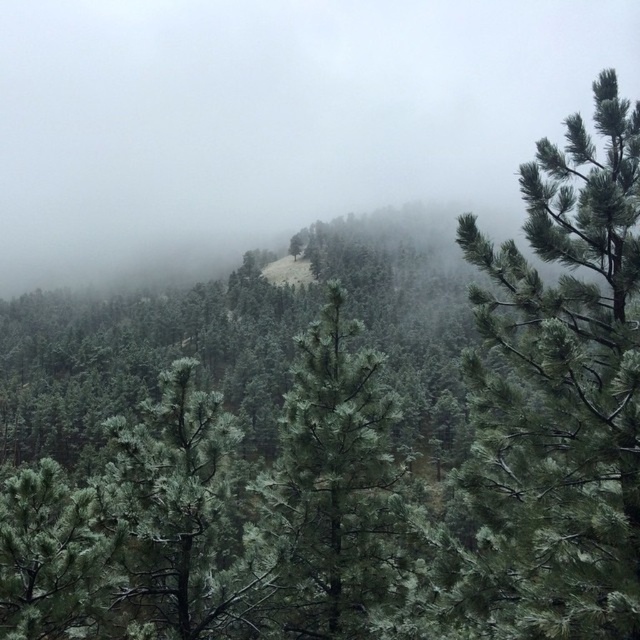
Question: Which point appears farthest from the camera in this image?

Choices:
 (A) (628, 262)
 (B) (323, 353)

Answer: (B)

Question: Among these points, which one is nearest to the camera?

Choices:
 (A) (358, 595)
 (B) (563, 157)

Answer: (B)

Question: Does green matte pine tree at center have a greater width compared to green needle-like tree at center?

Choices:
 (A) no
 (B) yes

Answer: (B)

Question: Is green matte pine tree at center positioned before green needle-like tree at center?

Choices:
 (A) yes
 (B) no

Answer: (A)

Question: Can you confirm if green matte pine tree at center is positioned below green needle-like tree at center?

Choices:
 (A) no
 (B) yes

Answer: (A)

Question: Which object is closer to the camera taking this photo?

Choices:
 (A) green matte pine tree at center
 (B) green needle-like tree at center

Answer: (A)